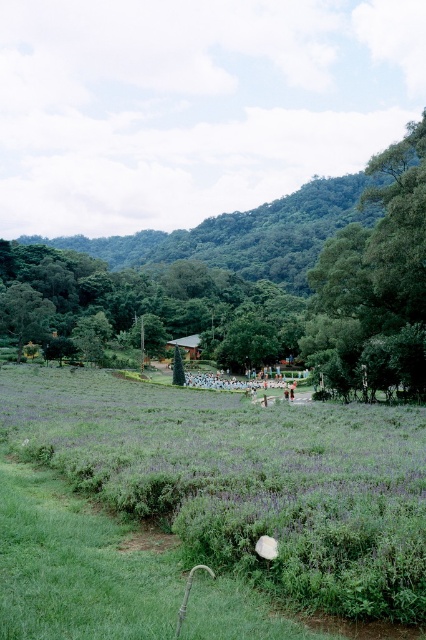
Question: Which object appears closest to the camera in this image?

Choices:
 (A) green grass at center
 (B) green leafy tree at center
 (C) green leafy tree at upper right

Answer: (A)

Question: Is green grass at center closer to the viewer compared to green leafy tree at center?

Choices:
 (A) no
 (B) yes

Answer: (B)

Question: Which of the following is the closest to the observer?

Choices:
 (A) green grass at center
 (B) green leafy tree at center
 (C) green leafy tree at upper right

Answer: (A)

Question: Does green leafy tree at center have a greater width compared to green leafy tree at upper right?

Choices:
 (A) yes
 (B) no

Answer: (A)

Question: Estimate the real-world distances between objects in this image. Which object is farther from the green grass at center?

Choices:
 (A) green leafy tree at center
 (B) green leafy tree at upper right

Answer: (A)

Question: Can you confirm if green grass at center is wider than green leafy tree at upper right?

Choices:
 (A) no
 (B) yes

Answer: (B)